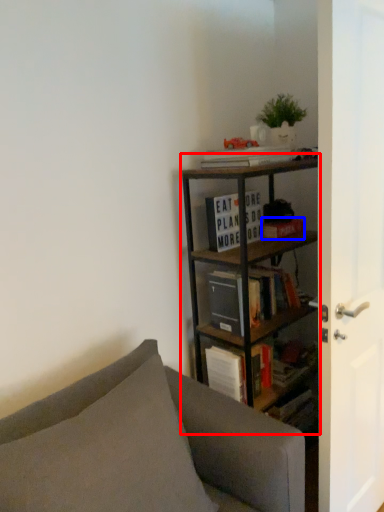
Question: Which point is further to the camera, bookcase (highlighted by a red box) or paperback book (highlighted by a blue box)?

Choices:
 (A) bookcase
 (B) paperback book

Answer: (B)